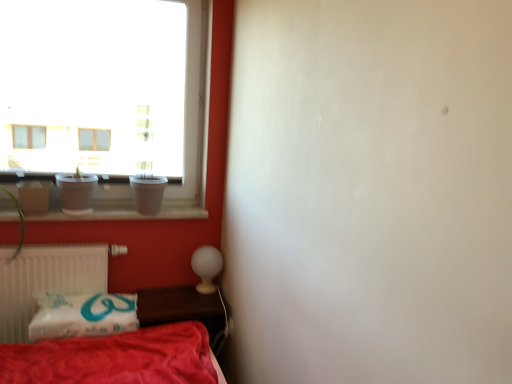
This screenshot has height=384, width=512. I want to click on free location in front of white glossy table lamp at lower center, so click(197, 304).